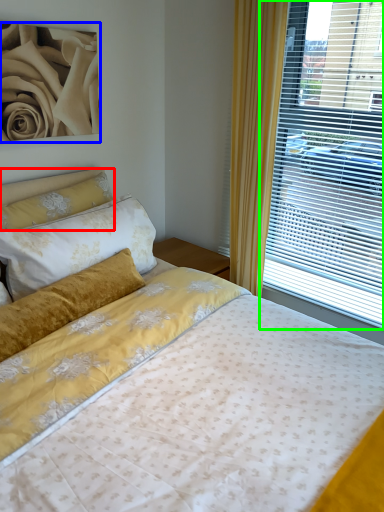
Question: Based on their relative distances, which object is nearer to pillow (highlighted by a red box)? Choose from rose (highlighted by a blue box) and window (highlighted by a green box).

Choices:
 (A) rose
 (B) window

Answer: (A)